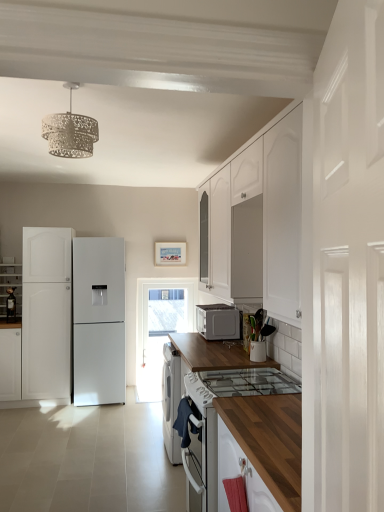
Identify the location of free space in front of white matte refrigerator at left, positioned as the 3th cabinetry in left-to-right order. (34, 417).